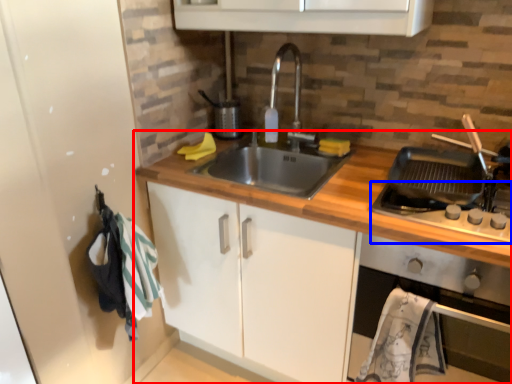
Question: Which point is further to the camera, countertop (highlighted by a red box) or gas stove (highlighted by a blue box)?

Choices:
 (A) countertop
 (B) gas stove

Answer: (B)